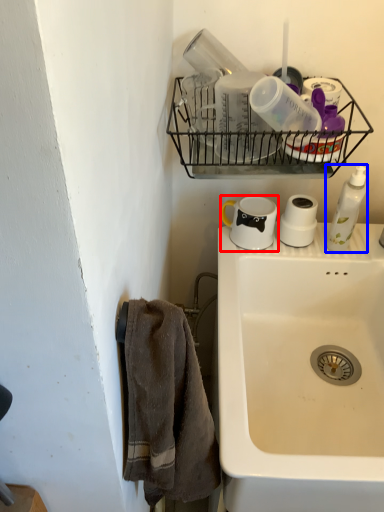
Question: Among these objects, which one is farthest to the camera, coffee cup (highlighted by a red box) or soap dispenser (highlighted by a blue box)?

Choices:
 (A) coffee cup
 (B) soap dispenser

Answer: (A)